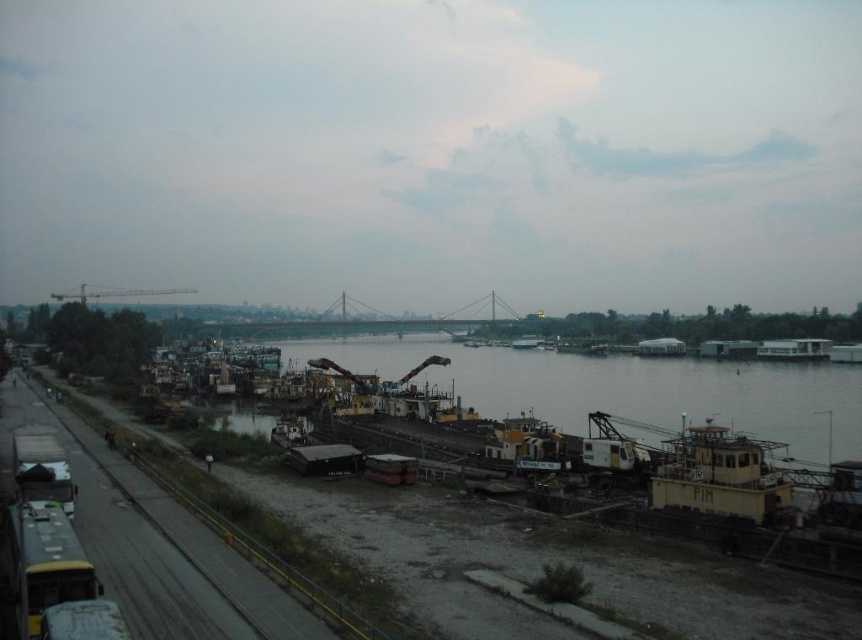
Can you confirm if metallic gray crane at upper center is thinner than yellow matte barge at center?

Incorrect, metallic gray crane at upper center's width is not less than yellow matte barge at center's.

Which is more to the left, metallic gray crane at upper center or yellow matte barge at center?

From the viewer's perspective, metallic gray crane at upper center appears more on the left side.

Which is behind, point (88, 296) or point (531, 344)?

The point (88, 296) is more distant.

Find the location of a particular element. The width and height of the screenshot is (862, 640). metallic gray crane at upper center is located at coordinates (113, 292).

The width and height of the screenshot is (862, 640). What do you see at coordinates (209, 540) in the screenshot?
I see `metallic gray train track at center` at bounding box center [209, 540].

I want to click on metallic gray train track at center, so click(x=209, y=540).

Does metallic yellow barge at center have a lesser height compared to metallic gray train track at center?

No, metallic yellow barge at center is not shorter than metallic gray train track at center.

Who is taller, metallic yellow barge at center or metallic gray train track at center?

metallic yellow barge at center

Who is more forward, [541,360] or [173,545]?

Point [173,545]

Where is `metallic yellow barge at center`? This screenshot has width=862, height=640. metallic yellow barge at center is located at coordinates (629, 388).